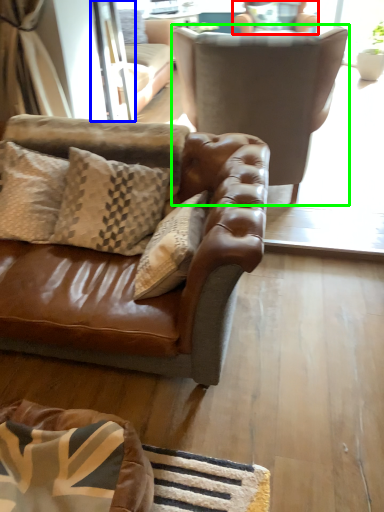
Question: Estimate the real-world distances between objects in this image. Which object is farther from chair (highlighted by a red box), screen door (highlighted by a blue box) or chair (highlighted by a green box)?

Choices:
 (A) screen door
 (B) chair

Answer: (A)